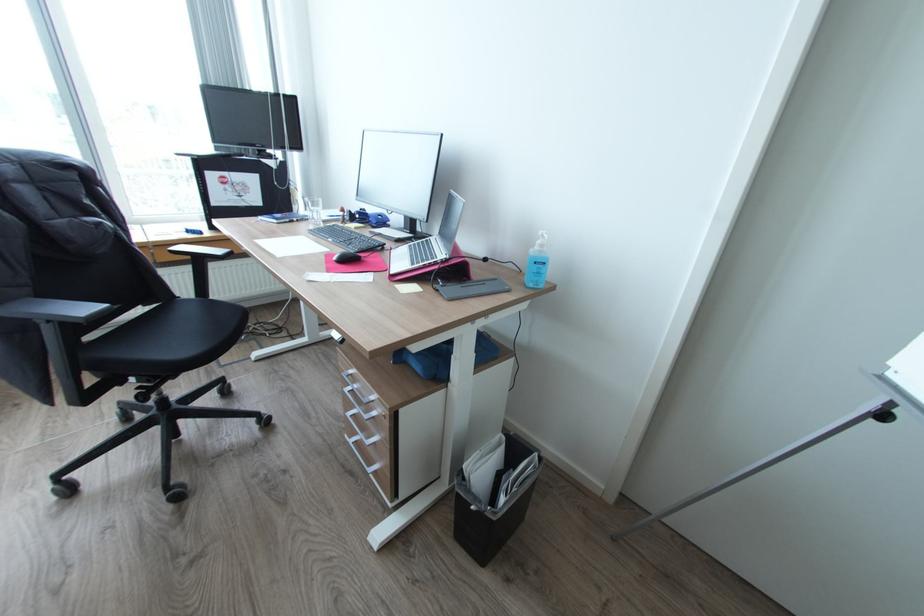
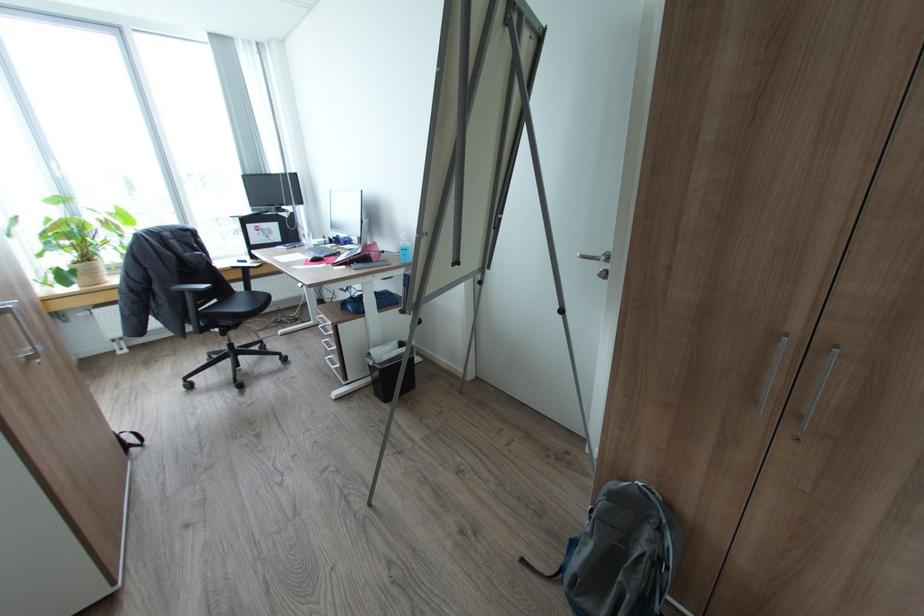
Locate, in the second image, the point that corresponds to the point at 55,321 in the first image.

(195, 292)